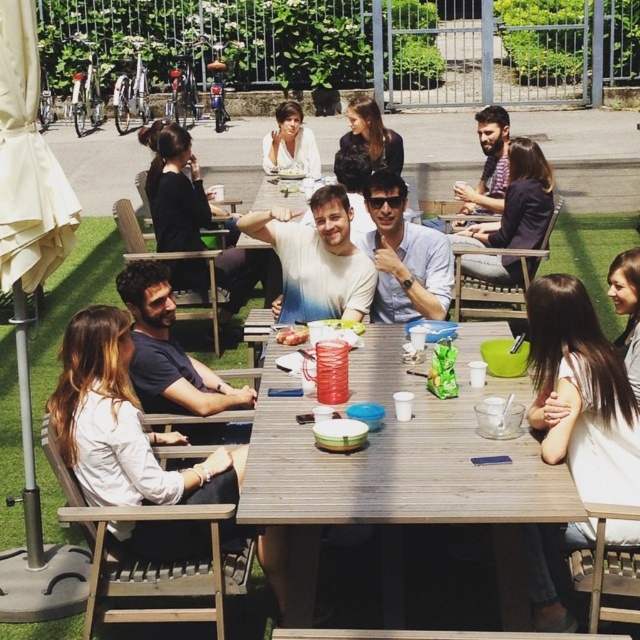
You are taking a photo of the outdoor gathering and want to focus on both the point at (545, 508) and the point at (307, 172). Which point is closer to your camera?

The point at (545, 508) is closer to the camera than the point at (307, 172).

You are planning to place a large rectangular cake on the wooden table at center. The cake is as wide as the white shirt at lower left. Will the cake fit on the table?

The wooden table at center is wider than the white shirt at lower left, so the cake, which is as wide as the white shirt at lower left, will fit on the table.